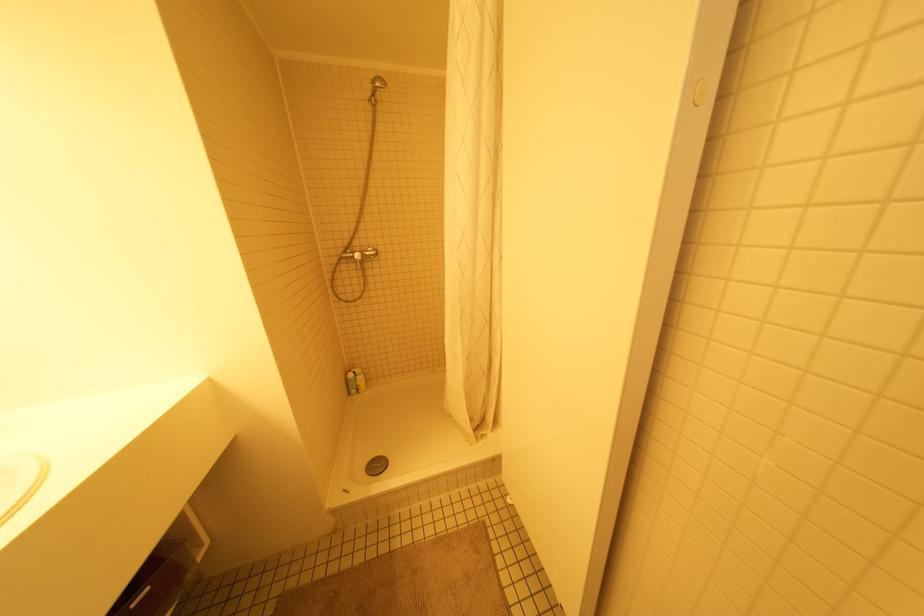
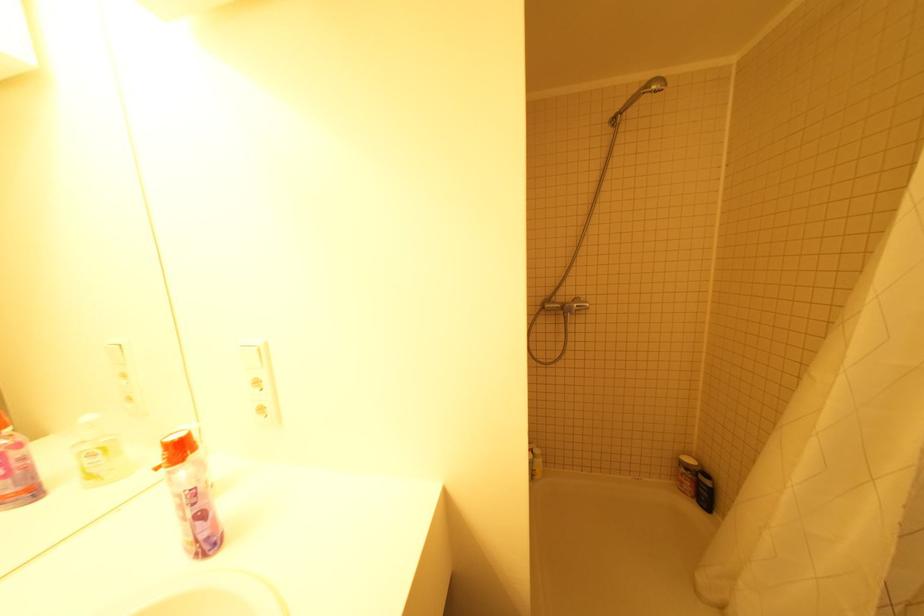
Where in the second image is the point corresponding to point 346,257 from the first image?

(550, 310)